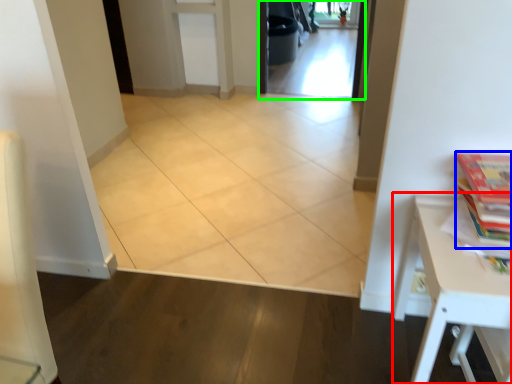
Question: Considering the real-world distances, which object is farthest from table (highlighted by a red box)? book (highlighted by a blue box) or screen door (highlighted by a green box)?

Choices:
 (A) book
 (B) screen door

Answer: (B)